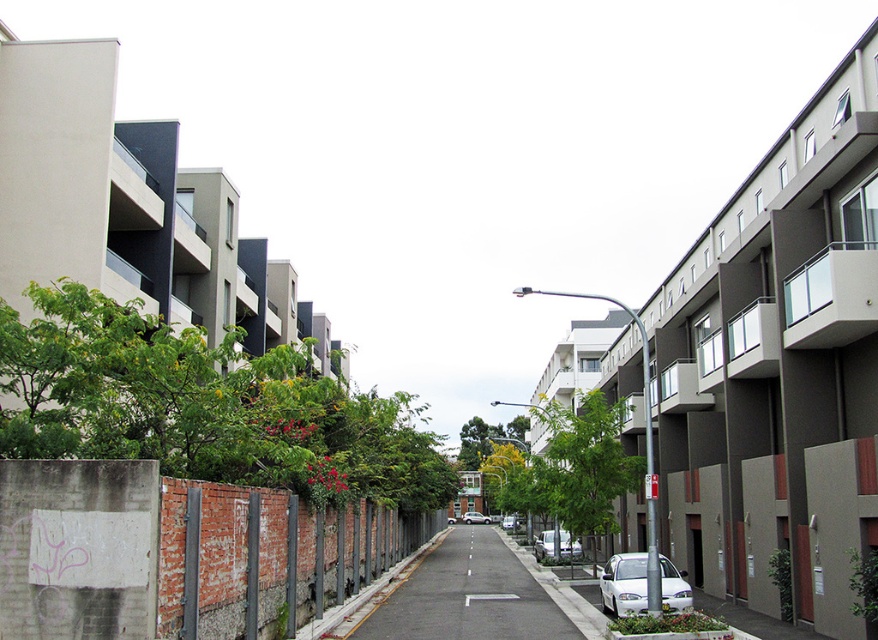
Question: Which of these objects is positioned closest to the green leafy tree at left?

Choices:
 (A) asphalt road at center
 (B) green leafy tree at center

Answer: (A)

Question: Does green leafy tree at left have a lesser width compared to asphalt road at center?

Choices:
 (A) no
 (B) yes

Answer: (A)

Question: Can you confirm if green leafy tree at left is positioned below green leafy tree at center?

Choices:
 (A) yes
 (B) no

Answer: (B)

Question: Which point is farther from the camera taking this photo?

Choices:
 (A) (308, 384)
 (B) (472, 611)
 (C) (556, 413)

Answer: (C)

Question: Which point is closer to the camera taking this photo?

Choices:
 (A) (509, 488)
 (B) (429, 556)
 (C) (171, 464)

Answer: (C)

Question: Does green leafy tree at left come behind green leafy tree at center?

Choices:
 (A) yes
 (B) no

Answer: (B)